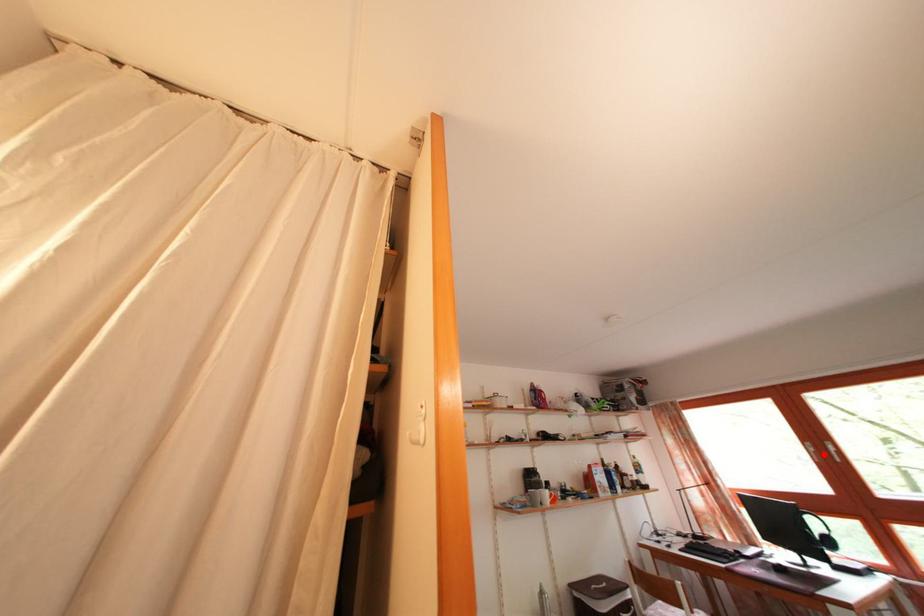
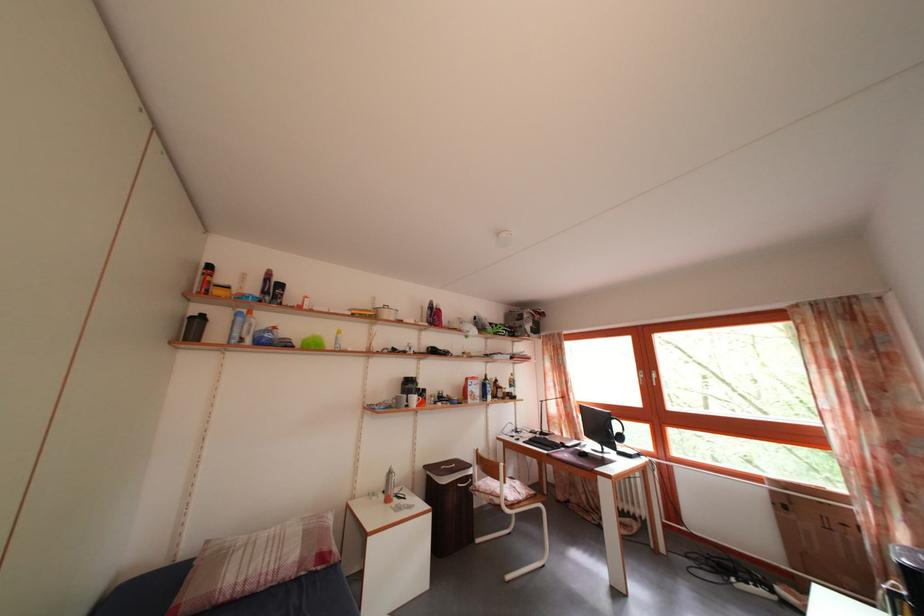
Question: I am providing you with two images of the same scene from different viewpoints. In image1, a red point is highlighted. Considering the same 3D point in image2, which of the following is correct?

Choices:
 (A) It is closer
 (B) It is farther

Answer: (B)